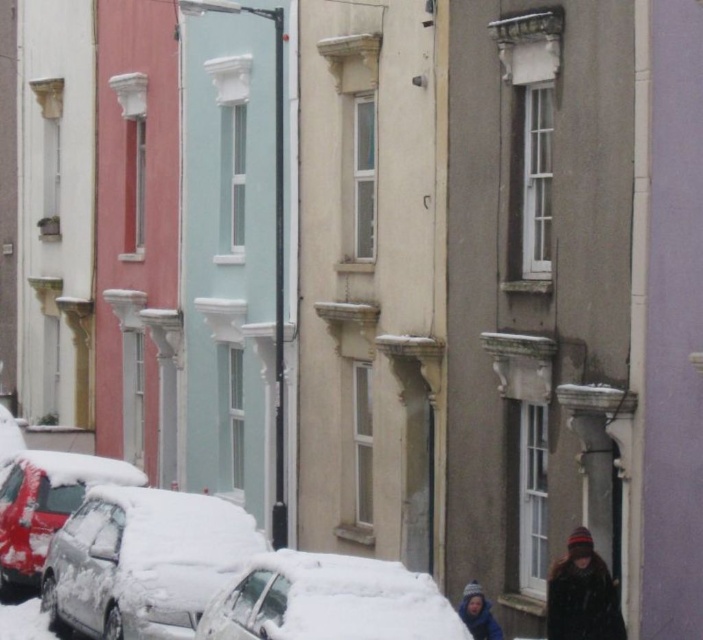
You are standing on the snowy street in front of the terraced houses. You see two points marked on the image. Which point is closer to you, point (375, 611) or point (479, 592)?

Point (375, 611) is closer to the viewer than point (479, 592).